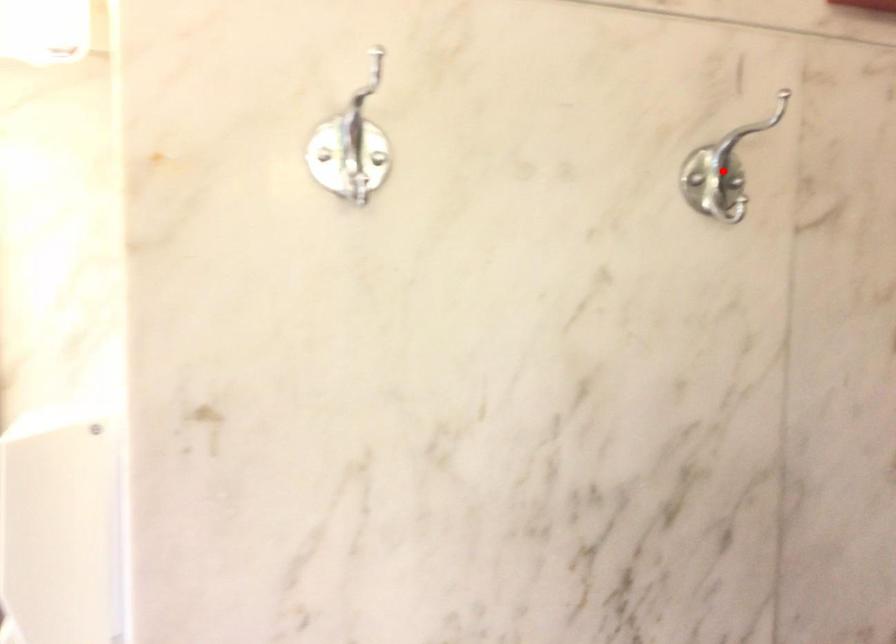
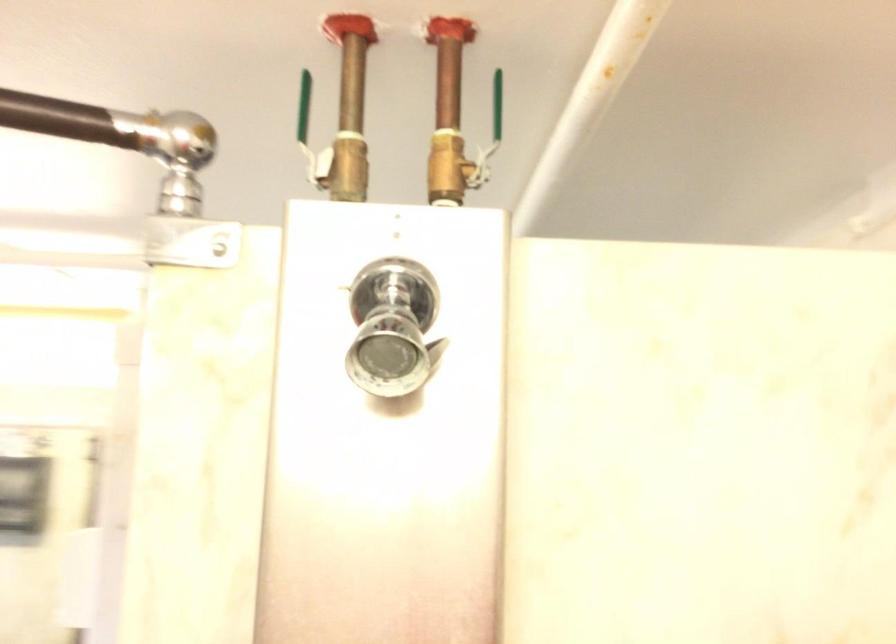
Question: I am providing you with two images of the same scene from different viewpoints. A red point is marked on the first image. Can you still see the location of the red point in image 2?

Choices:
 (A) Yes
 (B) No

Answer: (B)